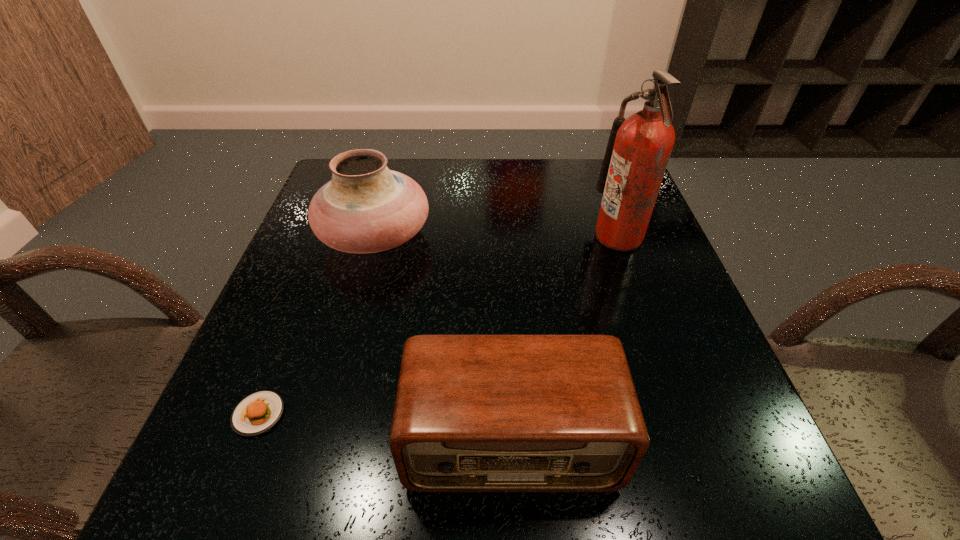
Locate an element on the screen. The height and width of the screenshot is (540, 960). vacant point that satisfies the following two spatial constraints: 1. on the front of the rightmost object near the operation label; 2. on the front panel of the third tallest object is located at coordinates (692, 442).

Where is `vacant position in the image that satisfies the following two spatial constraints: 1. on the back side of the food; 2. on the left side of the pottery`? vacant position in the image that satisfies the following two spatial constraints: 1. on the back side of the food; 2. on the left side of the pottery is located at coordinates (328, 237).

This screenshot has width=960, height=540. Identify the location of free location that satisfies the following two spatial constraints: 1. on the front of the tallest object near the operation label; 2. on the front panel of the radio receiver. (692, 442).